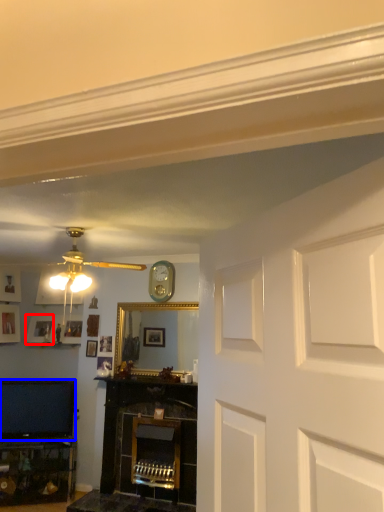
Question: Which of the following is the farthest to the observer, picture frame (highlighted by a red box) or television (highlighted by a blue box)?

Choices:
 (A) picture frame
 (B) television

Answer: (A)